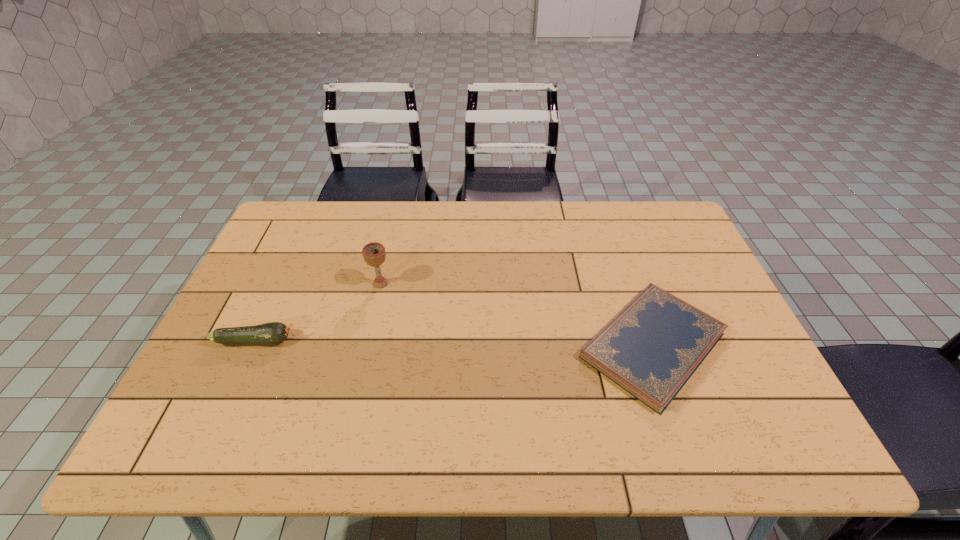
What are the coordinates of `free area in between the paperback book and the second object from right to left` in the screenshot? It's located at (516, 314).

You are a GUI agent. You are given a task and a screenshot of the screen. Output one action in this format:
    pyautogui.click(x=<x>, y=<y>)
    Task: Click on the vacant area between the rightmost object and the chalice
    The height and width of the screenshot is (540, 960).
    Given the screenshot: What is the action you would take?
    pyautogui.click(x=516, y=314)

In order to click on free spot between the second object from right to left and the second shortest object in this screenshot , I will do `click(318, 312)`.

Locate an element on the screen. The width and height of the screenshot is (960, 540). vacant space in between the leftmost object and the paperback book is located at coordinates (454, 343).

You are a GUI agent. You are given a task and a screenshot of the screen. Output one action in this format:
    pyautogui.click(x=<x>, y=<y>)
    Task: Click on the empty space between the leftmost object and the rightmost object
    
    Given the screenshot: What is the action you would take?
    pyautogui.click(x=454, y=343)

This screenshot has height=540, width=960. I want to click on free space between the chalice and the shortest object, so pyautogui.click(x=516, y=314).

Locate an element on the screen. The height and width of the screenshot is (540, 960). the second closest object to the leftmost object is located at coordinates (651, 348).

The width and height of the screenshot is (960, 540). I want to click on object that is the second nearest to the leftmost object, so click(651, 348).

Where is `vacant area in the image that satisfies the following two spatial constraints: 1. at the blossom end of the second shortest object; 2. on the left side of the rightmost object`? vacant area in the image that satisfies the following two spatial constraints: 1. at the blossom end of the second shortest object; 2. on the left side of the rightmost object is located at coordinates (253, 346).

Where is `free spot that satisfies the following two spatial constraints: 1. at the blossom end of the zucchini; 2. on the left side of the shortest object`? free spot that satisfies the following two spatial constraints: 1. at the blossom end of the zucchini; 2. on the left side of the shortest object is located at coordinates (253, 346).